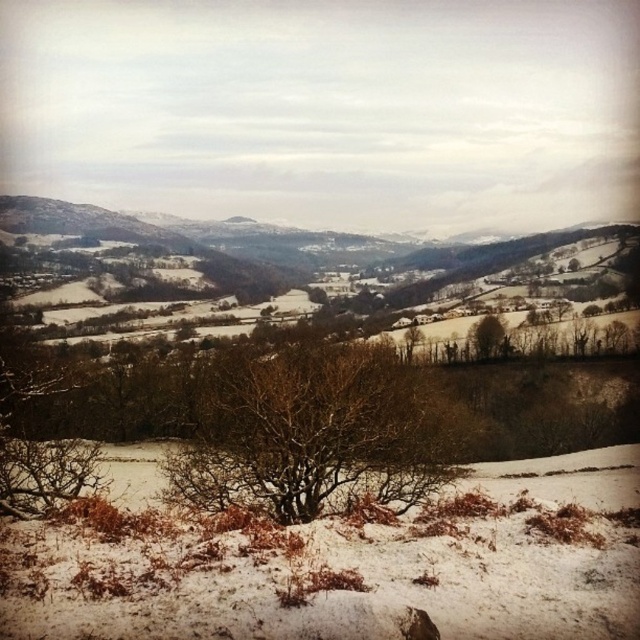
Question: Which point is farther from the camera taking this photo?

Choices:
 (A) (435, 477)
 (B) (496, 320)

Answer: (B)

Question: Does bare branches at center appear over brown textured tree at center?

Choices:
 (A) no
 (B) yes

Answer: (A)

Question: Is bare branches at center positioned behind brown textured tree at center?

Choices:
 (A) yes
 (B) no

Answer: (B)

Question: Which object appears farthest from the camera in this image?

Choices:
 (A) brown textured tree at center
 (B) bare branches at center

Answer: (A)

Question: Observing the image, what is the correct spatial positioning of bare branches at center in reference to brown textured tree at center?

Choices:
 (A) below
 (B) above

Answer: (A)